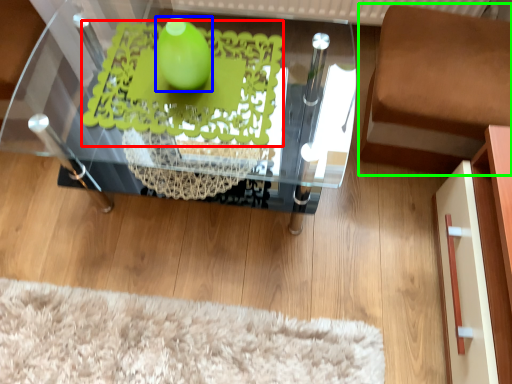
Question: Considering the real-world distances, which object is closest to design (highlighted by a red box)? lime (highlighted by a blue box) or furniture (highlighted by a green box).

Choices:
 (A) lime
 (B) furniture

Answer: (A)